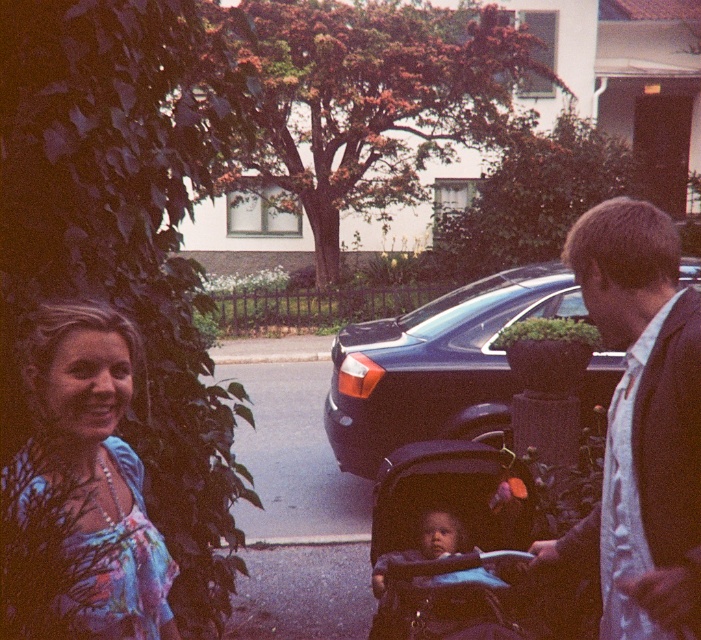
Consider the image. You are a photographer standing 3 feet away from the floral fabric blouse at left. You want to take a photo of the smooth blue baby carriage at center without moving the baby. Can you reach the carriage from your current position without moving? Explain your reasoning.

The floral fabric blouse at left and smooth blue baby carriage at center are 5.51 feet apart. Since you are 3 feet away from the floral fabric blouse at left, the distance between you and the smooth blue baby carriage at center is 5.51 feet minus 3 feet, which equals 2.51 feet. Therefore, you can easily reach the smooth blue baby carriage at center without moving the baby.

You are a delivery person who needs to park your shiny black car at center near the dark blue fabric stroller at center. The parking space is 10 feet long. Can you park your car there?

The dark blue fabric stroller at center is 9.60 feet away from the shiny black car at center. Since the parking space is 10 feet long, there is enough space to park the shiny black car at center near the dark blue fabric stroller at center.

You are a delivery person who needs to place a dark brown suit at right and a shiny black car at center in a storage room. The storage room has a width of 1.2 meters. Can both items fit side by side without overlapping?

The dark brown suit at right has a lesser width compared to shiny black car at center. The total width of both items combined would exceed the storage room width of 1.2 meters, so they cannot fit side by side without overlapping.